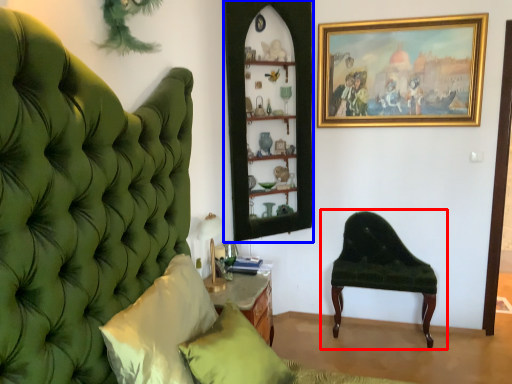
Question: Which of the following is the closest to the observer, chair (highlighted by a red box) or shelf (highlighted by a blue box)?

Choices:
 (A) chair
 (B) shelf

Answer: (B)